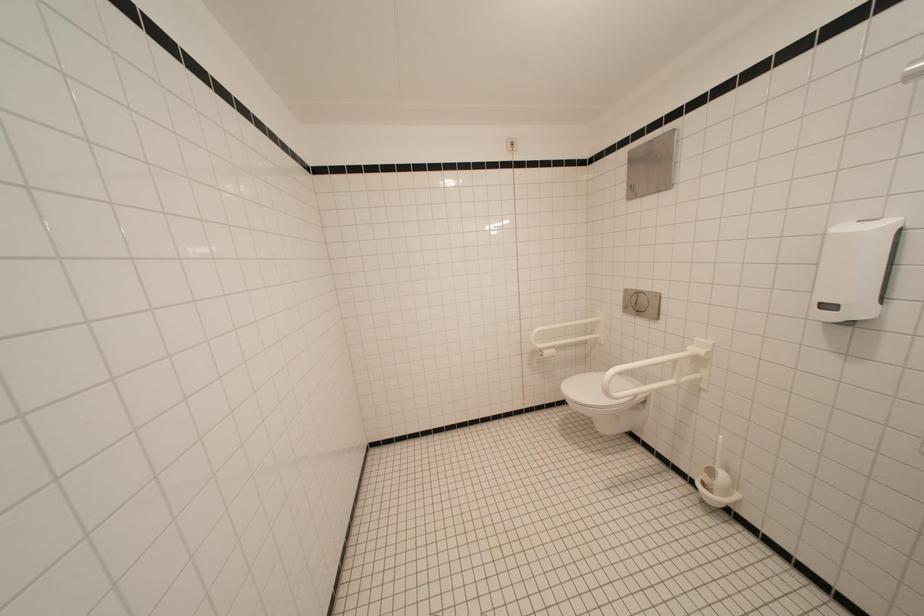
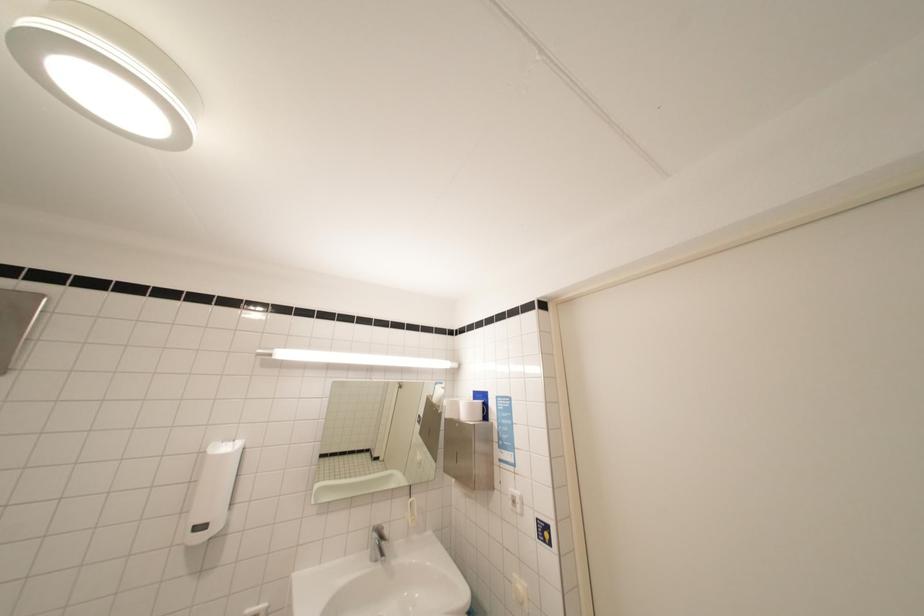
Based on the continuous images, in which direction is the camera rotating?

The camera's rotation is toward right-up.